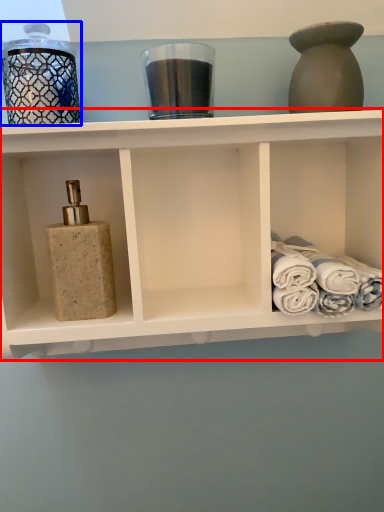
Question: Which object appears farthest to the camera in this image, shelf (highlighted by a red box) or glass jar (highlighted by a blue box)?

Choices:
 (A) shelf
 (B) glass jar

Answer: (B)